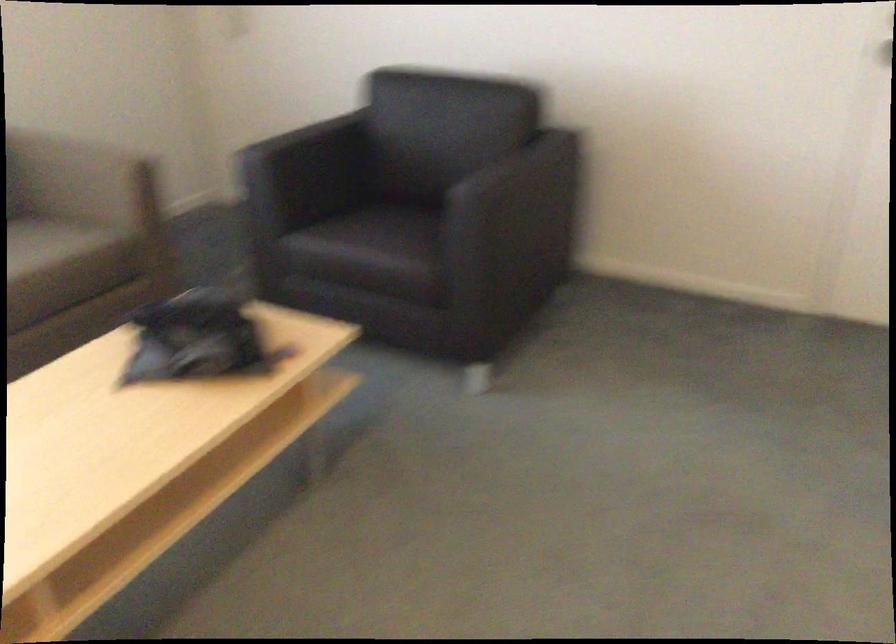
You are a GUI agent. You are given a task and a screenshot of the screen. Output one action in this format:
    pyautogui.click(x=<x>, y=<y>)
    Task: Click on the chair sitting surface
    
    Given the screenshot: What is the action you would take?
    pyautogui.click(x=368, y=240)